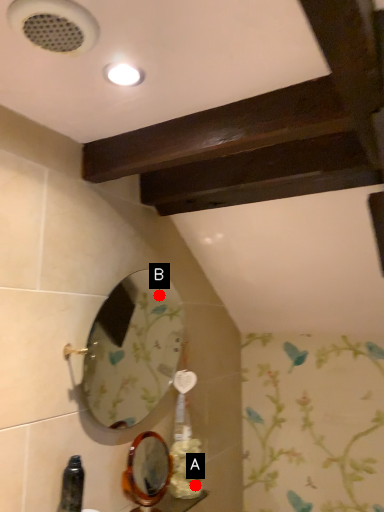
Question: Two points are circled on the image, labeled by A and B beside each circle. Which of the following is the closest to the observer?

Choices:
 (A) A is closer
 (B) B is closer

Answer: (A)